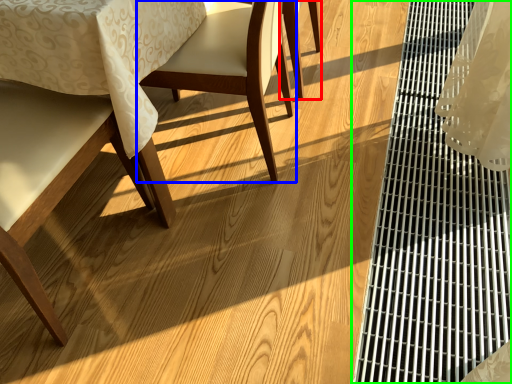
Question: Which object is positioned farthest from chair (highlighted by a red box)? Select from chair (highlighted by a blue box) and table (highlighted by a green box).

Choices:
 (A) chair
 (B) table

Answer: (B)